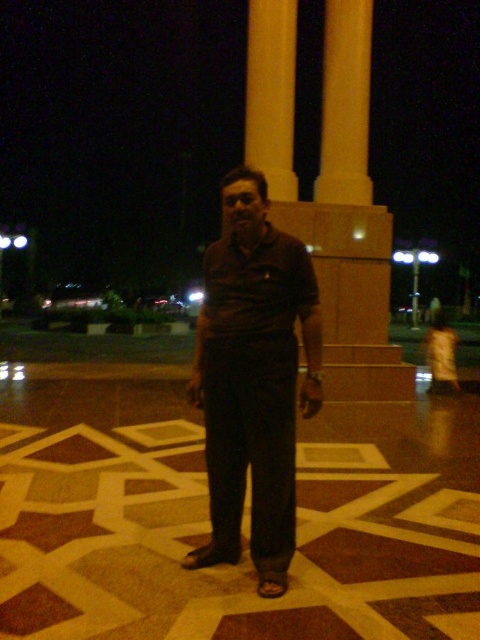
You are a photographer trying to capture the man and the monument in a single frame. Given that the matte brown shirt at center and the yellow polished stone pillar at upper center are both in your view, which object would require you to adjust your camera to a wider angle to fully capture its width?

The yellow polished stone pillar at upper center requires a wider angle because its width is greater than the matte brown shirt at center.

You are standing in the nighttime scene and want to place a small decorative item exactly at the point labeled as point (257, 452). If you are currently 4 meters away from the monument, can you reach that point without moving closer than 3 meters to the monument?

The distance of point (257, 452) from the viewer is 3.20 meters. Since you are currently 4 meters away from the monument, moving to 3.20 meters would require moving closer than 3 meters, so you cannot reach the point without violating the distance constraint.

You are a photographer trying to capture the monument and the man in the same frame. Since the matte brown shirt at center and the yellow polished stone pillar at upper center are both in your view, can you adjust your position so that the man is no longer blocking the pillar?

The matte brown shirt at center is in front of the yellow polished stone pillar at upper center, so moving the camera angle slightly to the side or adjusting the photographer position could allow the man to move out of the way, revealing the pillar behind him.